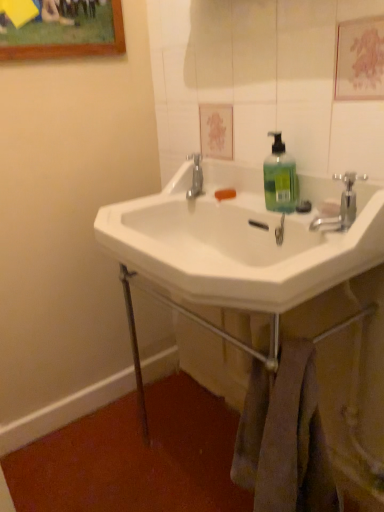
Question: Would you say white ceramic sink at center is to the left or to the right of white ceramic sink at center in the picture?

Choices:
 (A) right
 (B) left

Answer: (B)

Question: From a real-world perspective, is white ceramic sink at center above or below white ceramic sink at center?

Choices:
 (A) below
 (B) above

Answer: (B)

Question: Which object is the closest to the white ceramic sink at center?

Choices:
 (A) chrome metallic faucet at upper right
 (B) white ceramic sink at center
 (C) white glossy mirror at upper center
 (D) green translucent liquid at center

Answer: (D)

Question: Considering the real-world distances, which object is farthest from the white ceramic sink at center?

Choices:
 (A) white glossy mirror at upper center
 (B) white ceramic sink at center
 (C) green translucent liquid at center
 (D) chrome metallic faucet at upper right

Answer: (B)